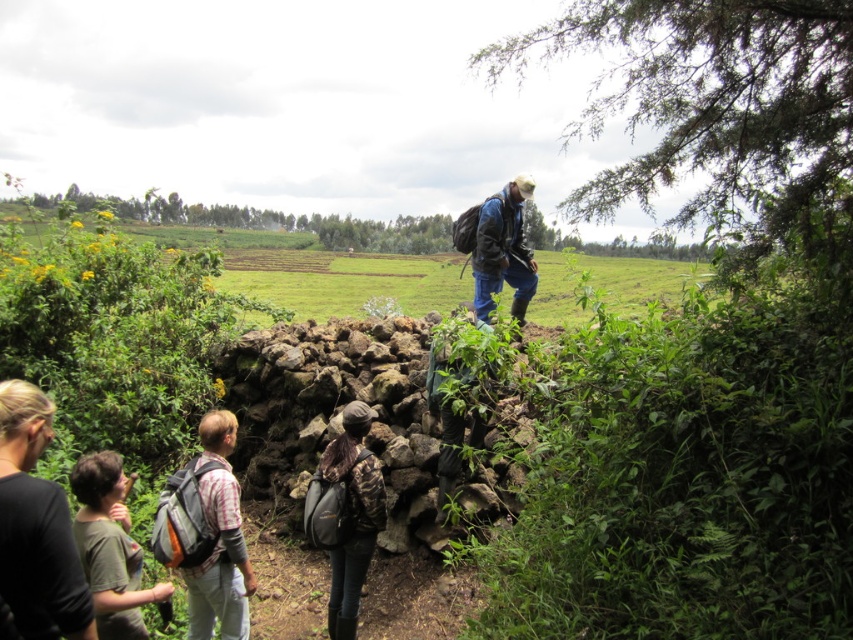
Question: Does black fabric shirt at lower left appear over blue fabric jacket at center?

Choices:
 (A) no
 (B) yes

Answer: (A)

Question: Can you confirm if black fabric shirt at lower left is positioned to the right of blue fabric jacket at center?

Choices:
 (A) no
 (B) yes

Answer: (A)

Question: Based on their relative distances, which object is farther from the blue fabric jacket at center?

Choices:
 (A) black fabric shirt at lower left
 (B) plaid fabric shirt at lower left

Answer: (A)

Question: Does black fabric shirt at lower left appear under blue fabric jacket at center?

Choices:
 (A) no
 (B) yes

Answer: (B)

Question: Which point is farther from the camera taking this photo?

Choices:
 (A) (235, 620)
 (B) (80, 570)
 (C) (520, 236)

Answer: (C)

Question: Which of the following is the closest to the observer?

Choices:
 (A) plaid fabric shirt at lower left
 (B) blue fabric jacket at center

Answer: (A)